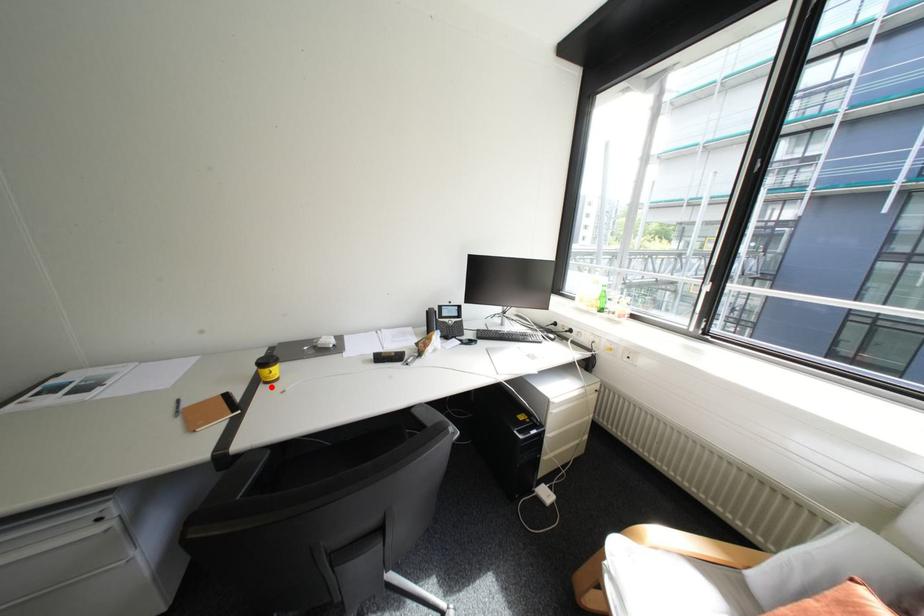
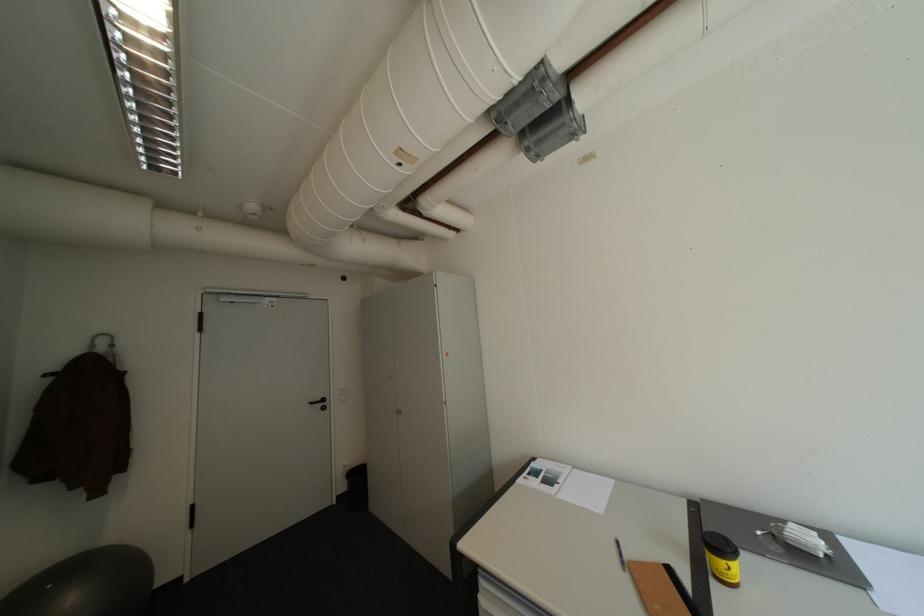
Locate, in the second image, the point that corresponds to the highlighted location in the first image.

(723, 584)